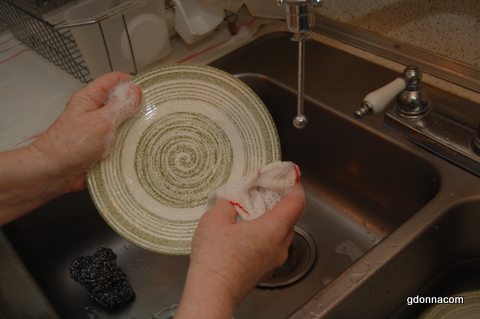
Image resolution: width=480 pixels, height=319 pixels. Find the location of `wall`. wall is located at coordinates (426, 34).